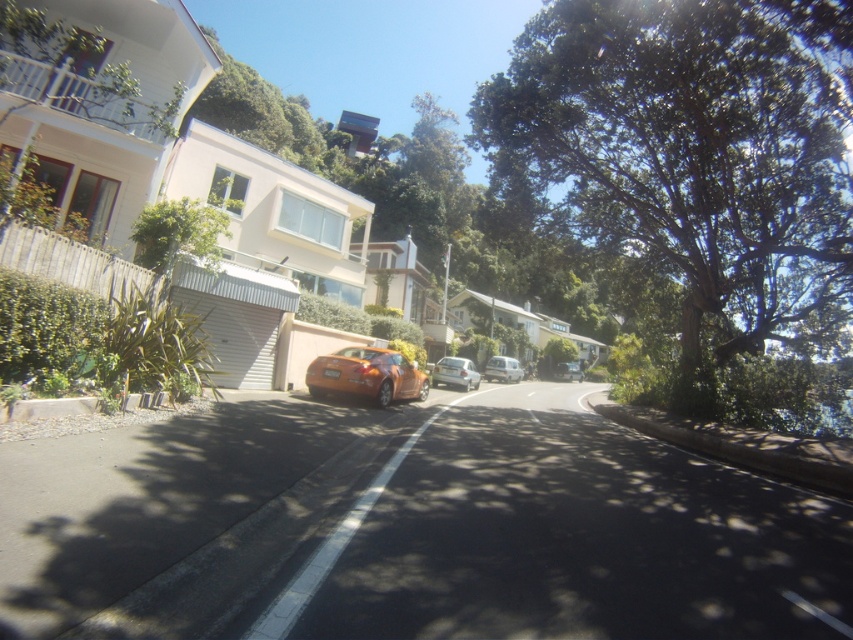
You are a pedestrian standing on the sidewalk on the left side of the street. You want to cross the street to reach the green leafy tree at upper right. Is the silver metallic car at center blocking your path?

The green leafy tree at upper right is located above the silver metallic car at center, so the car is positioned below the tree. Since you are on the left sidewalk, you would cross to the right side where the tree is, but the car is not directly in your path as it is positioned below the tree, so you can walk around it or pass by safely.

In the scene shown: You are standing on the sidewalk and want to take a photo of both the green leafy tree at upper right and the silver metallic car at center. Which object should you position closer to the front of your camera frame to include both in the shot?

To include both the green leafy tree at upper right and the silver metallic car at center in your photo, position the green leafy tree at upper right closer to the front of the camera frame since it is closer to the viewer than the silver metallic car at center.